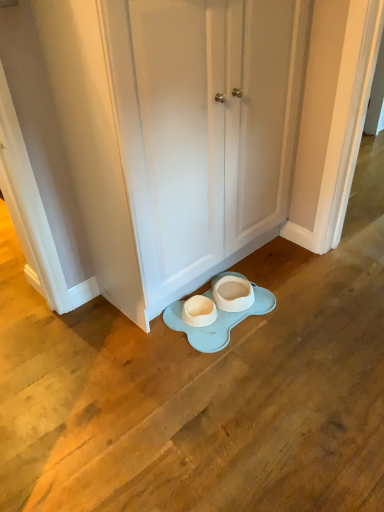
I want to click on free space in front of white matte porcelain at center, so click(221, 371).